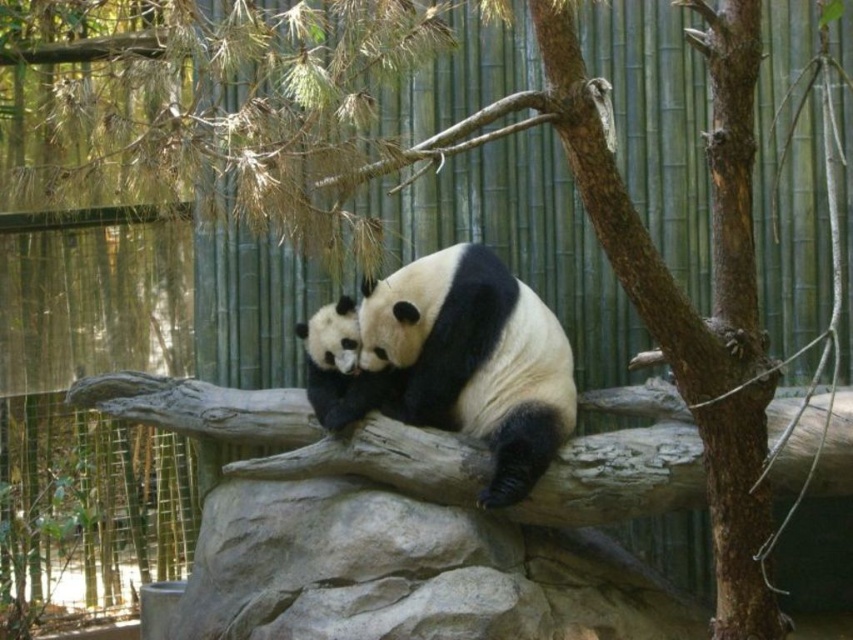
Is black fur panda at center smaller than brown rough tree trunk at center right?

No.

Who is positioned more to the right, black fur panda at center or brown rough tree trunk at center right?

From the viewer's perspective, brown rough tree trunk at center right appears more on the right side.

This screenshot has height=640, width=853. Identify the location of black fur panda at center. tap(466, 362).

You are a GUI agent. You are given a task and a screenshot of the screen. Output one action in this format:
    pyautogui.click(x=<x>, y=<y>)
    Task: Click on the black fur panda at center
    Image resolution: width=853 pixels, height=640 pixels.
    Given the screenshot: What is the action you would take?
    pyautogui.click(x=466, y=362)

Describe the element at coordinates (466, 362) in the screenshot. I see `black fur panda at center` at that location.

Image resolution: width=853 pixels, height=640 pixels. I want to click on black fur panda at center, so (466, 362).

Does brown rough tree trunk at center right have a greater height compared to black fuzzy panda at center?

Indeed, brown rough tree trunk at center right has a greater height compared to black fuzzy panda at center.

Does brown rough tree trunk at center right appear under black fuzzy panda at center?

No.

Is point (717, 545) closer to viewer compared to point (375, 396)?

That is True.

Where is `brown rough tree trunk at center right`? brown rough tree trunk at center right is located at coordinates (732, 161).